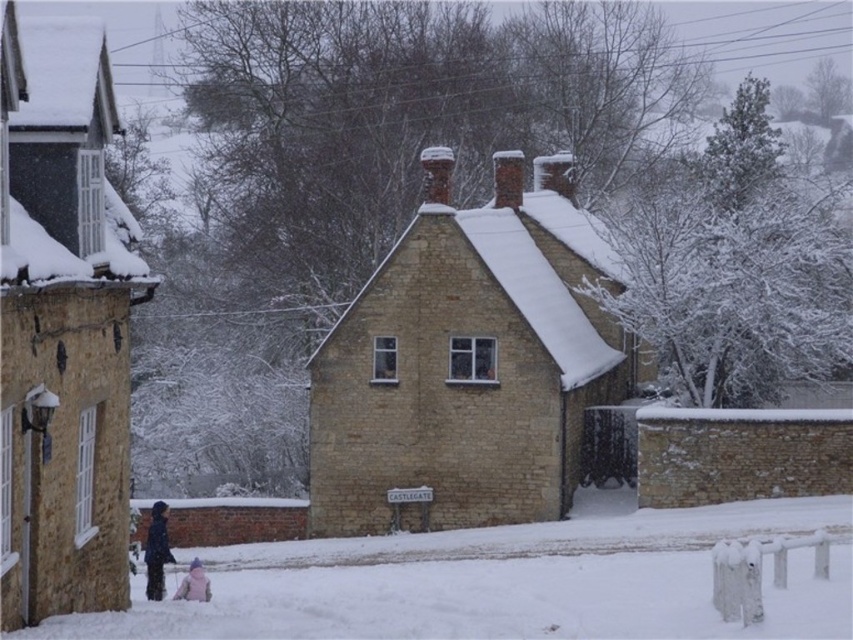
Question: Does white fluffy snow at lower center have a larger size compared to dark blue jacket at lower left?

Choices:
 (A) no
 (B) yes

Answer: (B)

Question: Which point appears closest to the camera in this image?

Choices:
 (A) (689, 579)
 (B) (166, 504)
 (C) (207, 579)

Answer: (A)

Question: Which of the following is the farthest from the observer?

Choices:
 (A) (190, 595)
 (B) (766, 582)

Answer: (A)

Question: In this image, where is white fluffy snow at lower center located relative to dark blue jacket at lower left?

Choices:
 (A) left
 (B) right

Answer: (B)

Question: Is white fluffy snow at lower center to the right of pink fabric at lower center from the viewer's perspective?

Choices:
 (A) yes
 (B) no

Answer: (A)

Question: Considering the real-world distances, which object is farthest from the pink fabric at lower center?

Choices:
 (A) white fluffy snow at lower center
 (B) dark blue jacket at lower left

Answer: (A)